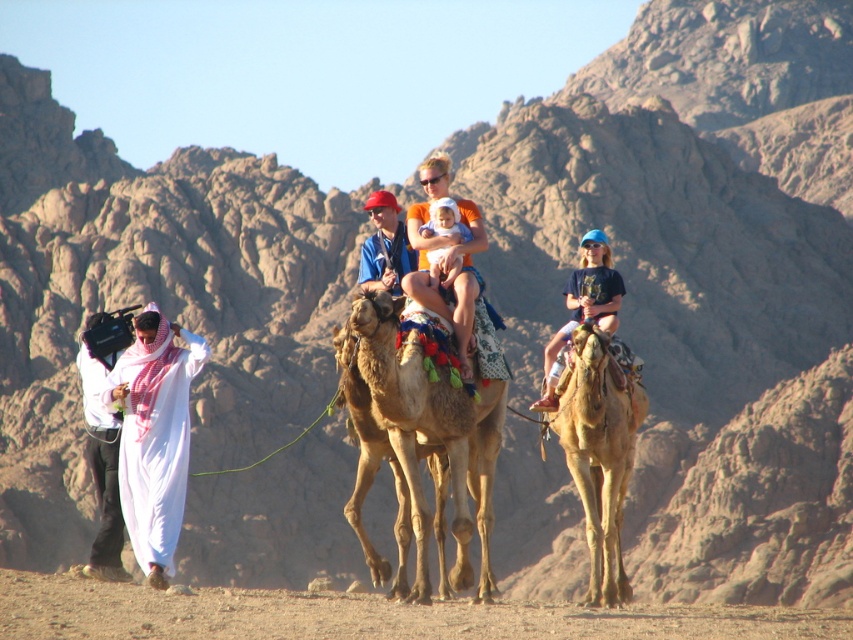
From the picture: In the desert scene with rugged mountains, there are two people visible. One is a white clothed man at left and the other is a blue cotton shirt at right. Which of these two is larger in size?

The white clothed man at left is bigger than the blue cotton shirt at right.

Which object is wider, the white clothed man at left or the blue cotton shirt at right?

The white clothed man at left is wider than the blue cotton shirt at right.

You are standing in the desert and see the brown textured camel at center and the matte blue shirt at center. Which object is located higher in the image?

The matte blue shirt at center is higher because the brown textured camel at center is positioned under it.